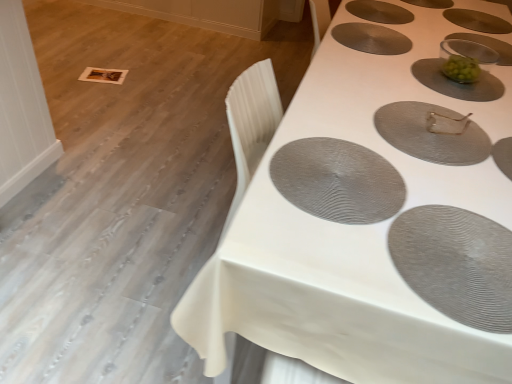
At what (x,y) coordinates should I click in order to perform the action: click on empty space that is ontop of green matte bowl at upper right, which is the fourth oval from back to front (from a real-world perspective). Please return your answer as a coordinate pair (x, y). Image resolution: width=512 pixels, height=384 pixels. Looking at the image, I should click on (442, 72).